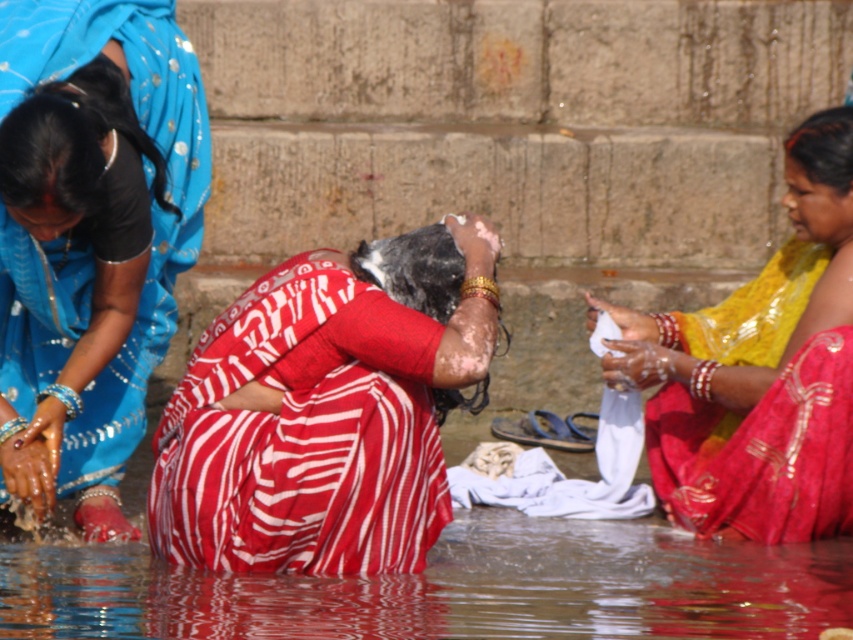
Question: Which point is farther to the camera?

Choices:
 (A) yellow satin saree at right
 (B) matte red sari at center
 (C) red striped saree at center

Answer: (A)

Question: Is red striped saree at center above yellow satin saree at right?

Choices:
 (A) yes
 (B) no

Answer: (B)

Question: Among these objects, which one is nearest to the camera?

Choices:
 (A) red striped saree at center
 (B) matte red sari at center
 (C) clear water at lower center
 (D) yellow satin saree at right

Answer: (C)

Question: Which object is positioned farthest from the clear water at lower center?

Choices:
 (A) matte red sari at center
 (B) yellow satin saree at right

Answer: (A)

Question: Considering the relative positions of red striped saree at center and yellow satin saree at right in the image provided, where is red striped saree at center located with respect to yellow satin saree at right?

Choices:
 (A) right
 (B) left

Answer: (B)

Question: Can you confirm if matte red sari at center is smaller than yellow satin saree at right?

Choices:
 (A) yes
 (B) no

Answer: (B)